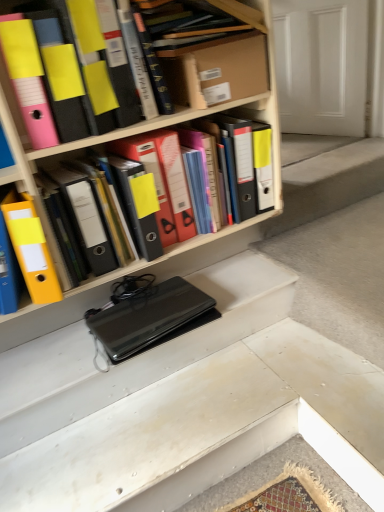
I want to click on vacant space that is to the left of black matte laptop at center, so click(x=52, y=362).